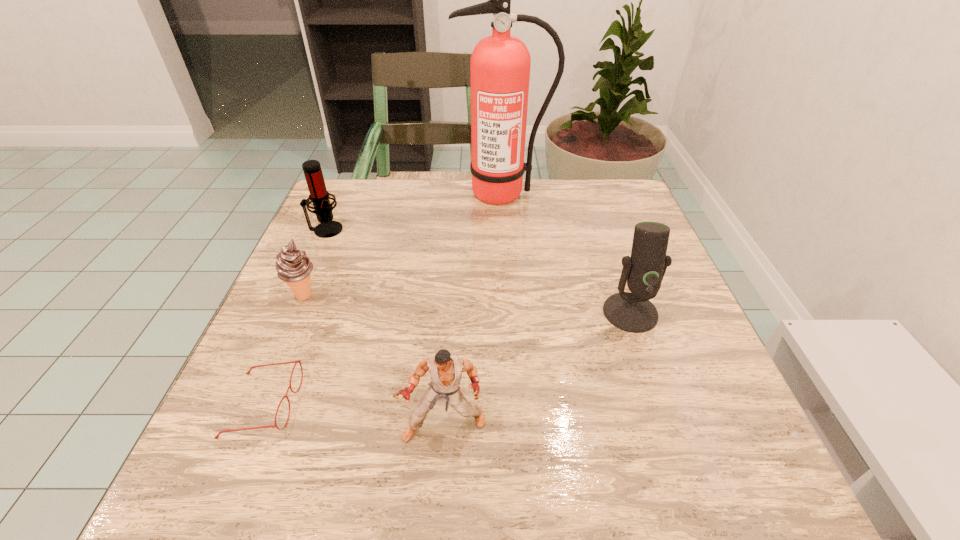
Choose which object is the third nearest neighbor to the farther microphone. Please provide its 2D coordinates. Your answer should be formatted as a tuple, i.e. [(x, y)], where the tuple contains the x and y coordinates of a point satisfying the conditions above.

[(298, 361)]

Select which object is the third closest to the tallest object. Please provide its 2D coordinates. Your answer should be formatted as a tuple, i.e. [(x, y)], where the tuple contains the x and y coordinates of a point satisfying the conditions above.

[(293, 266)]

Identify the location of free point that satisfies the following two spatial constraints: 1. on the front side of the rightmost object; 2. on the left side of the icecream. The width and height of the screenshot is (960, 540). (298, 313).